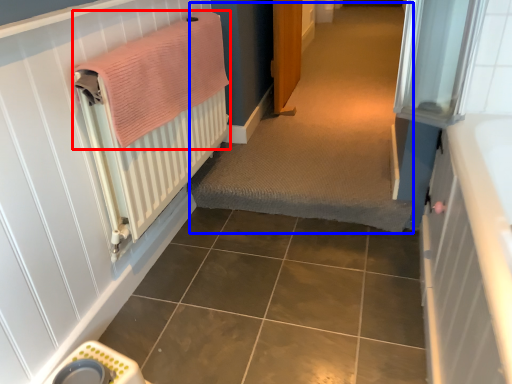
Question: Which point is further to the camera, bath towel (highlighted by a red box) or plain (highlighted by a blue box)?

Choices:
 (A) bath towel
 (B) plain

Answer: (B)